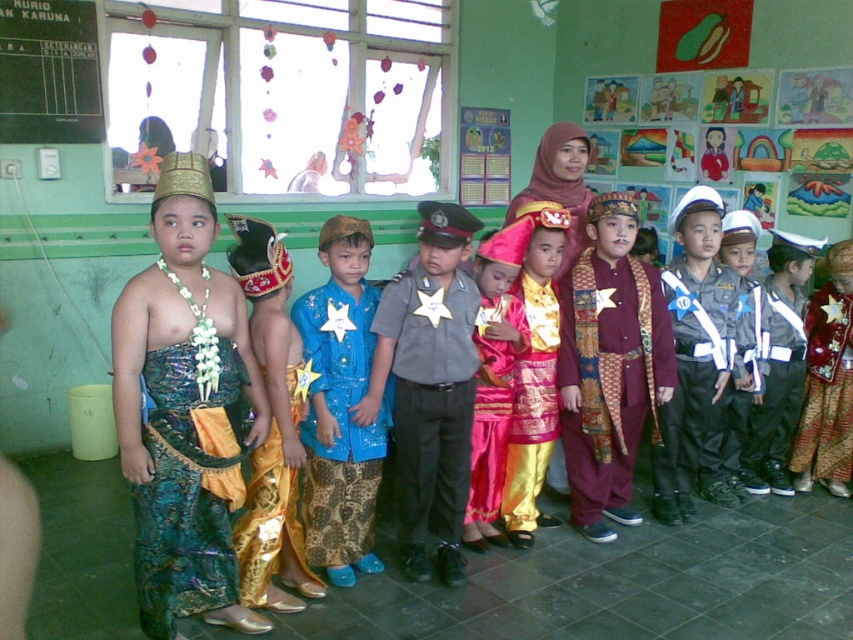
You are a photographer preparing to take a group photo of the children in the classroom. You notice the gray uniform at center and the blue batik pants at center. Which clothing item is covering the other one?

The gray uniform at center is positioned over blue batik pants at center, so the gray uniform at center is covering the blue batik pants at center.

You are a photographer trying to capture the shiny teal fabric dress at left in the classroom. The dress is positioned at coordinates approximately 0.767 on the x and 0.218 on the y axis. If you are standing at the origin point of the room, which direction should you move to get closer to the dress?

The shiny teal fabric dress at left is located at point 0.767 on the x and 0.218 on the y axis. Since the x coordinate is higher than 0.5, you should move to the right to increase your x position. The y coordinate is lower than 0.5, so you should move forward to decrease your y position. Therefore, move diagonally forward and to the right to reach the dress.